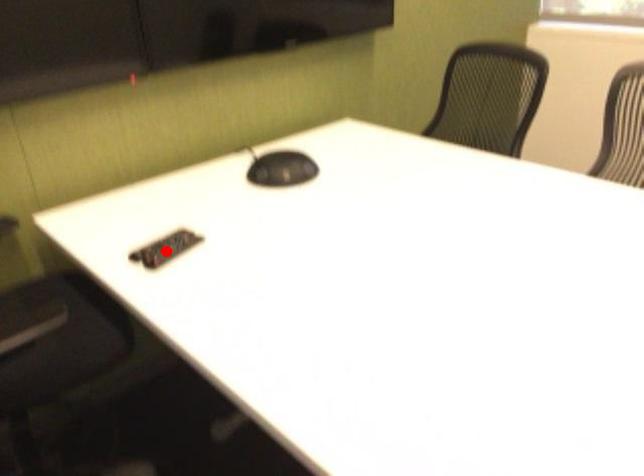
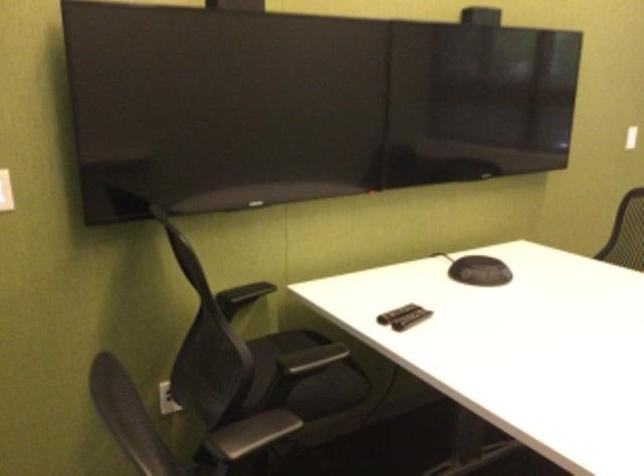
The point at the highlighted location is marked in the first image. Where is the corresponding point in the second image?

(411, 319)